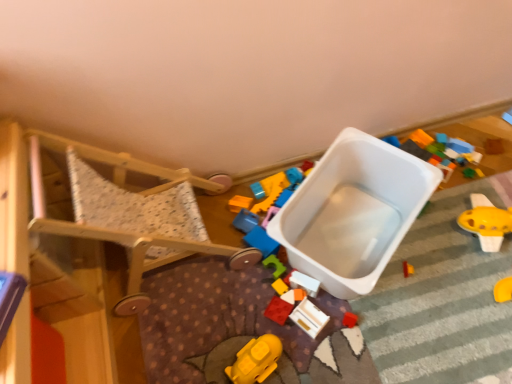
Describe the element at coordinates (256, 360) in the screenshot. This screenshot has height=384, width=512. I see `yellow matte toy at lower center, placed as the 6th toy when sorted from right to left` at that location.

What do you see at coordinates (304, 283) in the screenshot?
I see `white plastic toy at center, the 3th toy positioned from the right` at bounding box center [304, 283].

Find the location of a particular element. This screenshot has height=384, width=512. wooden walker at left is located at coordinates (73, 264).

How much space does rubber yellow toy at center, placed as the fourth toy when sorted from right to left, occupy vertically?

rubber yellow toy at center, placed as the fourth toy when sorted from right to left, is 3.43 centimeters in height.

Locate an element on the screen. The width and height of the screenshot is (512, 384). wooden toy at center, which appears as the fifth toy when viewed from the left is located at coordinates (309, 318).

I want to click on white plastic storage box at center, so click(x=353, y=212).

Is wooden toy at center, which appears as the fifth toy when viewed from the left, touching yellow matte toy at lower center, placed as the 6th toy when sorted from right to left?

wooden toy at center, which appears as the fifth toy when viewed from the left, is not next to yellow matte toy at lower center, placed as the 6th toy when sorted from right to left, and they're not touching.

From the image's perspective, is wooden toy at center, the second toy in the right-to-left sequence, located above yellow matte toy at lower center, placed as the 6th toy when sorted from right to left?

Indeed, from the image's perspective, wooden toy at center, the second toy in the right-to-left sequence, is shown above yellow matte toy at lower center, placed as the 6th toy when sorted from right to left.

From a real-world perspective, which object stands above the other?

yellow matte toy at lower center, which is counted as the first toy, starting from the left, is physically above.

You are a GUI agent. You are given a task and a screenshot of the screen. Output one action in this format:
    pyautogui.click(x=<x>, y=<y>)
    Task: Click on the 1st toy positioned above the yellow matte toy at lower center, placed as the 6th toy when sorted from right to left (from the image's perspective)
    The image size is (512, 384).
    Given the screenshot: What is the action you would take?
    pyautogui.click(x=309, y=318)

Which point is more forward, [292,273] or [463,226]?

The point [292,273] is closer to the camera.

Is white plastic toy at center, which ranks as the fourth toy in left-to-right order, facing towards yellow plastic toy at right, which is counted as the first toy, starting from the right?

No, white plastic toy at center, which ranks as the fourth toy in left-to-right order, is not aimed at yellow plastic toy at right, which is counted as the first toy, starting from the right.

In terms of size, does white plastic toy at center, the 3th toy positioned from the right, appear bigger or smaller than yellow plastic toy at right, placed as the 6th toy when sorted from left to right?

Considering their sizes, white plastic toy at center, the 3th toy positioned from the right, takes up less space than yellow plastic toy at right, placed as the 6th toy when sorted from left to right.

Where is `the 1st toy behind the yellow plastic toy at right, which is counted as the first toy, starting from the right`? the 1st toy behind the yellow plastic toy at right, which is counted as the first toy, starting from the right is located at coordinates (304, 283).

Which of these two, rubber yellow toy at center, the 3th toy from the left, or wooden walker at left, stands taller?

With more height is wooden walker at left.

How different are the orientations of rubber yellow toy at center, the 3th toy from the left, and wooden walker at left in degrees?

60.2 degrees.

Considering the sizes of objects rubber yellow toy at center, the 3th toy from the left, and wooden walker at left in the image provided, who is bigger, rubber yellow toy at center, the 3th toy from the left, or wooden walker at left?

wooden walker at left is bigger.

From the image's perspective, between rubber yellow toy at center, placed as the fourth toy when sorted from right to left, and wooden walker at left, who is located below?

rubber yellow toy at center, placed as the fourth toy when sorted from right to left, appears lower in the image.

From the picture: Is rubberized red block at center, which is counted as the second toy, starting from the left, inside or outside of wooden toy at center, the second toy in the right-to-left sequence?

rubberized red block at center, which is counted as the second toy, starting from the left, cannot be found inside wooden toy at center, the second toy in the right-to-left sequence.

Is rubberized red block at center, which is counted as the second toy, starting from the left, not near wooden toy at center, the second toy in the right-to-left sequence?

That's not correct — rubberized red block at center, which is counted as the second toy, starting from the left, is a little close to wooden toy at center, the second toy in the right-to-left sequence.

Which is in front, point (267, 308) or point (315, 334)?

The point (315, 334) is more forward.

Which object is closer to the camera, rubberized red block at center, which is counted as the second toy, starting from the left, or wooden toy at center, which appears as the fifth toy when viewed from the left?

wooden toy at center, which appears as the fifth toy when viewed from the left, is closer to the camera.

Looking at this image, from the image's perspective, which is below, yellow plastic toy at right, placed as the 6th toy when sorted from left to right, or rubber yellow toy at center, placed as the fourth toy when sorted from right to left?

rubber yellow toy at center, placed as the fourth toy when sorted from right to left, from the image's perspective.

Is yellow plastic toy at right, placed as the 6th toy when sorted from left to right, wider or thinner than rubber yellow toy at center, the 3th toy from the left?

In the image, yellow plastic toy at right, placed as the 6th toy when sorted from left to right, appears to be wider than rubber yellow toy at center, the 3th toy from the left.

Considering the sizes of objects yellow plastic toy at right, which is counted as the first toy, starting from the right, and rubber yellow toy at center, placed as the fourth toy when sorted from right to left, in the image provided, who is taller, yellow plastic toy at right, which is counted as the first toy, starting from the right, or rubber yellow toy at center, placed as the fourth toy when sorted from right to left,?

With more height is yellow plastic toy at right, which is counted as the first toy, starting from the right.

Does yellow plastic toy at right, which is counted as the first toy, starting from the right, come in front of rubber yellow toy at center, placed as the fourth toy when sorted from right to left?

Yes.

From a real-world perspective, does white plastic storage box at center stand above wooden walker at left?

No, from a real-world perspective, white plastic storage box at center is not above wooden walker at left.

Between white plastic storage box at center and wooden walker at left, which one appears on the left side from the viewer's perspective?

Positioned to the left is wooden walker at left.

Can you confirm if white plastic storage box at center is thinner than wooden walker at left?

Indeed, white plastic storage box at center has a lesser width compared to wooden walker at left.

The width and height of the screenshot is (512, 384). What are the coordinates of `storage box below the wooden walker at left (from a real-world perspective)` in the screenshot? It's located at (353, 212).

In terms of height, does white plastic toy at center, which ranks as the fourth toy in left-to-right order, look taller or shorter compared to wooden toy at center, which appears as the fifth toy when viewed from the left?

A: Considering their sizes, white plastic toy at center, which ranks as the fourth toy in left-to-right order, has more height than wooden toy at center, which appears as the fifth toy when viewed from the left.

Is white plastic toy at center, the 3th toy positioned from the right, positioned with its back to wooden toy at center, which appears as the fifth toy when viewed from the left?

That's not correct — white plastic toy at center, the 3th toy positioned from the right, is not looking away from wooden toy at center, which appears as the fifth toy when viewed from the left.

Is point (295, 275) in front of point (320, 327)?

No, it is behind (320, 327).

Which object is positioned more to the left, white plastic toy at center, the 3th toy positioned from the right, or wooden toy at center, which appears as the fifth toy when viewed from the left?

Positioned to the left is white plastic toy at center, the 3th toy positioned from the right.

Find the location of a particular element. toy lying in front of the wooden toy at center, the second toy in the right-to-left sequence is located at coordinates (256, 360).

The width and height of the screenshot is (512, 384). Identify the location of the 1st toy behind the yellow plastic toy at right, which is counted as the first toy, starting from the right, starting your count from the anchor. (304, 283).

Considering their positions, is yellow plastic toy at right, which is counted as the first toy, starting from the right, positioned closer to rubber yellow toy at center, placed as the fourth toy when sorted from right to left, than yellow matte toy at lower center, which is counted as the first toy, starting from the left?

The object closer to rubber yellow toy at center, placed as the fourth toy when sorted from right to left, is yellow matte toy at lower center, which is counted as the first toy, starting from the left.

Estimate the real-world distances between objects in this image. Which object is further from rubber yellow toy at center, placed as the fourth toy when sorted from right to left, yellow plastic toy at right, placed as the 6th toy when sorted from left to right, or wooden toy at center, the second toy in the right-to-left sequence?

Based on the image, yellow plastic toy at right, placed as the 6th toy when sorted from left to right, appears to be further to rubber yellow toy at center, placed as the fourth toy when sorted from right to left.

Based on their spatial positions, is yellow matte toy at lower center, placed as the 6th toy when sorted from right to left, or wooden walker at left closer to white plastic toy at center, which ranks as the fourth toy in left-to-right order?

yellow matte toy at lower center, placed as the 6th toy when sorted from right to left, is closer to white plastic toy at center, which ranks as the fourth toy in left-to-right order.

Which object lies further to the anchor point white plastic toy at center, which ranks as the fourth toy in left-to-right order, rubber yellow toy at center, the 3th toy from the left, or white plastic storage box at center?

white plastic storage box at center is further to white plastic toy at center, which ranks as the fourth toy in left-to-right order.

Looking at this image, considering their positions, is yellow matte toy at lower center, which is counted as the first toy, starting from the left, positioned further to rubberized red block at center, which is counted as the second toy, starting from the left, than white plastic storage box at center?

Based on the image, white plastic storage box at center appears to be further to rubberized red block at center, which is counted as the second toy, starting from the left.

Estimate the real-world distances between objects in this image. Which object is further from yellow matte toy at lower center, placed as the 6th toy when sorted from right to left, yellow plastic toy at right, which is counted as the first toy, starting from the right, or rubber yellow toy at center, placed as the fourth toy when sorted from right to left?

yellow plastic toy at right, which is counted as the first toy, starting from the right, is positioned further to the anchor yellow matte toy at lower center, placed as the 6th toy when sorted from right to left.

Looking at this image, when comparing their distances from yellow matte toy at lower center, placed as the 6th toy when sorted from right to left, does yellow plastic toy at right, which is counted as the first toy, starting from the right, or white plastic storage box at center seem further?

yellow plastic toy at right, which is counted as the first toy, starting from the right, is positioned further to the anchor yellow matte toy at lower center, placed as the 6th toy when sorted from right to left.

Which object lies further to the anchor point yellow matte toy at lower center, which is counted as the first toy, starting from the left, rubber yellow toy at center, the 3th toy from the left, or wooden toy at center, which appears as the fifth toy when viewed from the left?

rubber yellow toy at center, the 3th toy from the left, lies further to yellow matte toy at lower center, which is counted as the first toy, starting from the left, than the other object.

Locate an element on the screen. The width and height of the screenshot is (512, 384). storage box situated between wooden walker at left and yellow plastic toy at right, which is counted as the first toy, starting from the right, from left to right is located at coordinates (353, 212).

The height and width of the screenshot is (384, 512). Find the location of `toy between white plastic toy at center, the 3th toy positioned from the right, and yellow plastic toy at right, which is counted as the first toy, starting from the right, in the horizontal direction`. toy between white plastic toy at center, the 3th toy positioned from the right, and yellow plastic toy at right, which is counted as the first toy, starting from the right, in the horizontal direction is located at coordinates (309, 318).

Locate an element on the screen. storage box between white plastic toy at center, which ranks as the fourth toy in left-to-right order, and yellow plastic toy at right, which is counted as the first toy, starting from the right, in the horizontal direction is located at coordinates (353, 212).

Where is `storage box between yellow matte toy at lower center, placed as the 6th toy when sorted from right to left, and yellow plastic toy at right, which is counted as the first toy, starting from the right, from left to right`? This screenshot has height=384, width=512. storage box between yellow matte toy at lower center, placed as the 6th toy when sorted from right to left, and yellow plastic toy at right, which is counted as the first toy, starting from the right, from left to right is located at coordinates (353, 212).